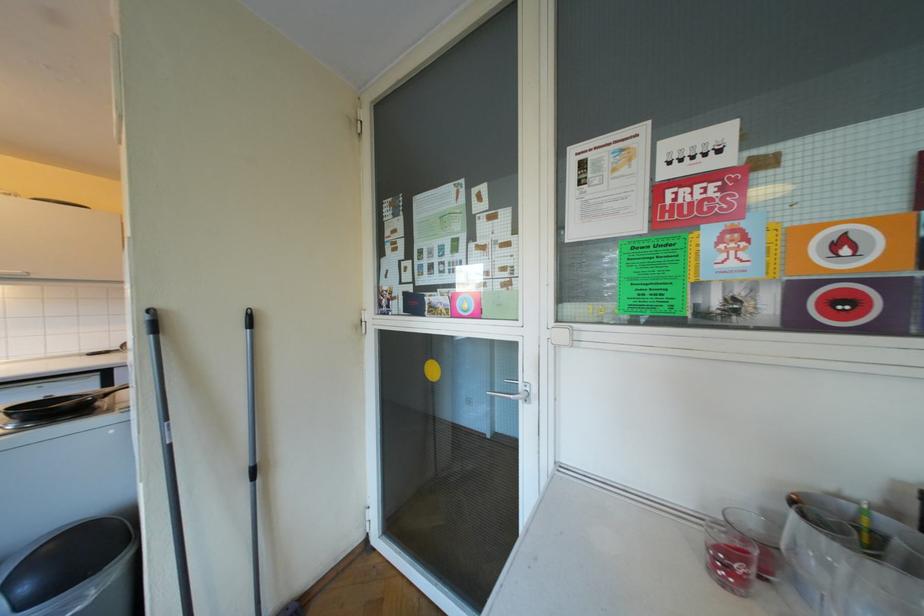
Where is `silver door handle`? silver door handle is located at coordinates (513, 395).